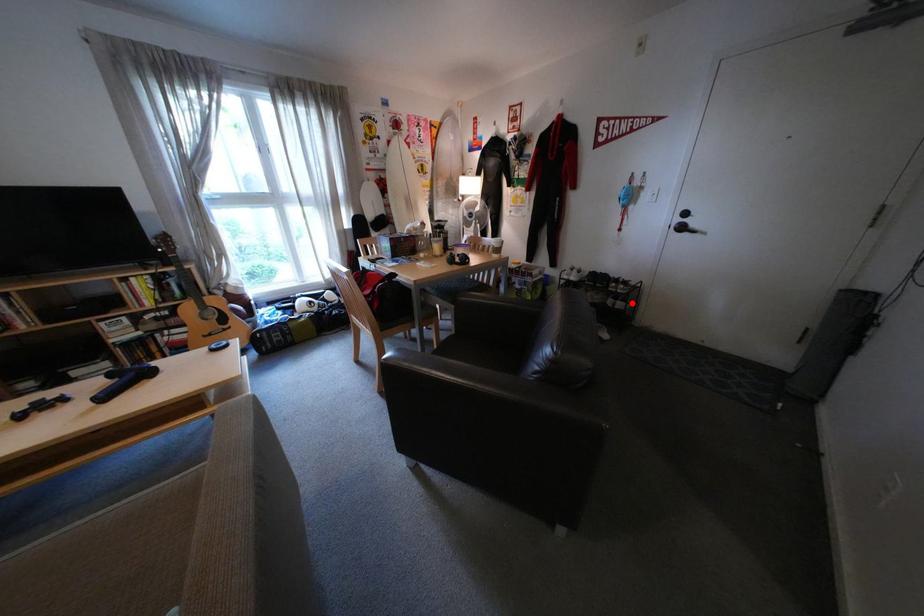
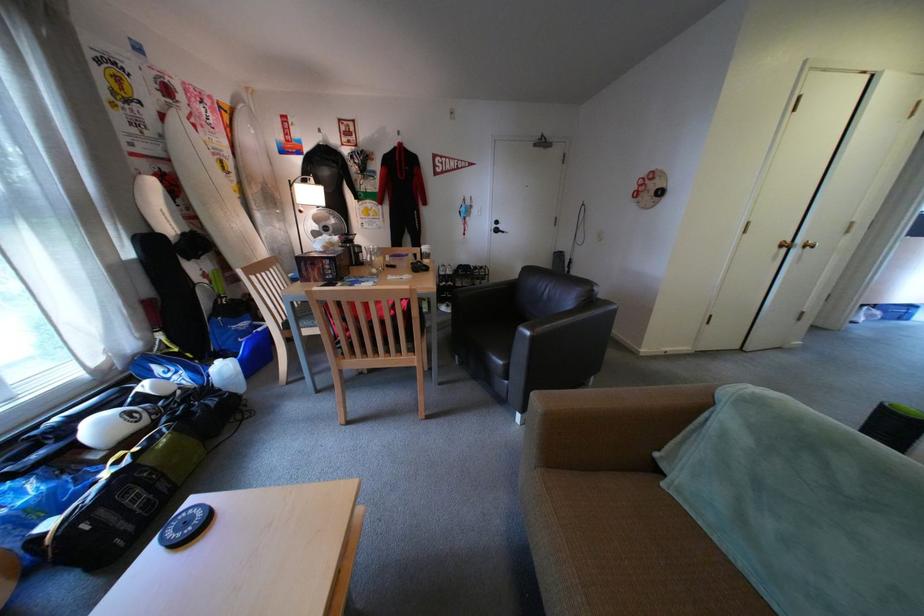
In the second image, find the point that corresponds to the highlighted location in the first image.

(496, 282)